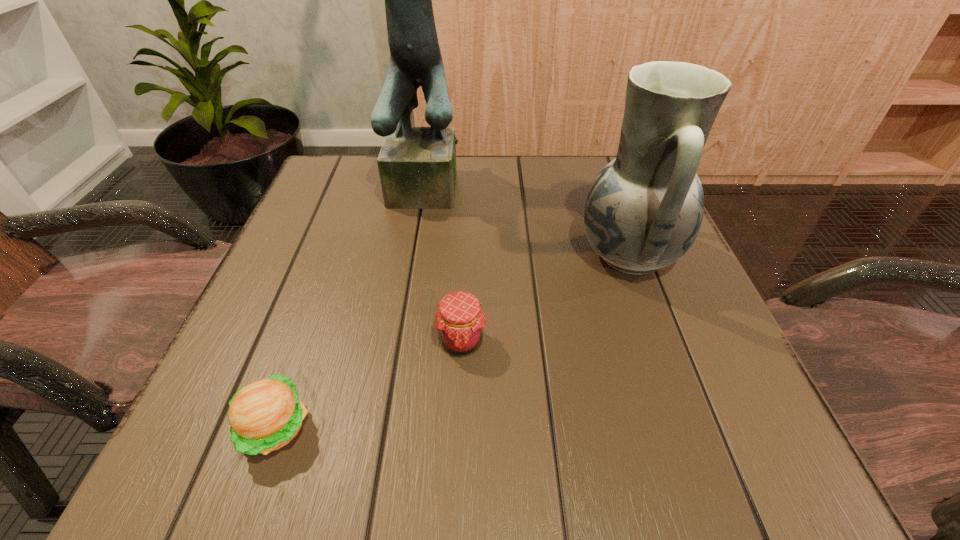
Identify the location of free area in between the hamburger and the tallest object. The image size is (960, 540). (354, 306).

Image resolution: width=960 pixels, height=540 pixels. I want to click on the third closest object to the leftmost object, so click(x=644, y=210).

The width and height of the screenshot is (960, 540). Find the location of `the second closest object relative to the tallest object`. the second closest object relative to the tallest object is located at coordinates (460, 322).

Locate an element on the screen. The height and width of the screenshot is (540, 960). vacant space that satisfies the following two spatial constraints: 1. on the face of the jam; 2. on the right side of the sculpture is located at coordinates (411, 341).

Image resolution: width=960 pixels, height=540 pixels. Identify the location of free space that satisfies the following two spatial constraints: 1. on the face of the sculpture; 2. on the left side of the jam. (411, 341).

Locate an element on the screen. This screenshot has height=540, width=960. vacant space that satisfies the following two spatial constraints: 1. on the front-facing side of the second tallest object; 2. on the front side of the nearest object is located at coordinates (693, 427).